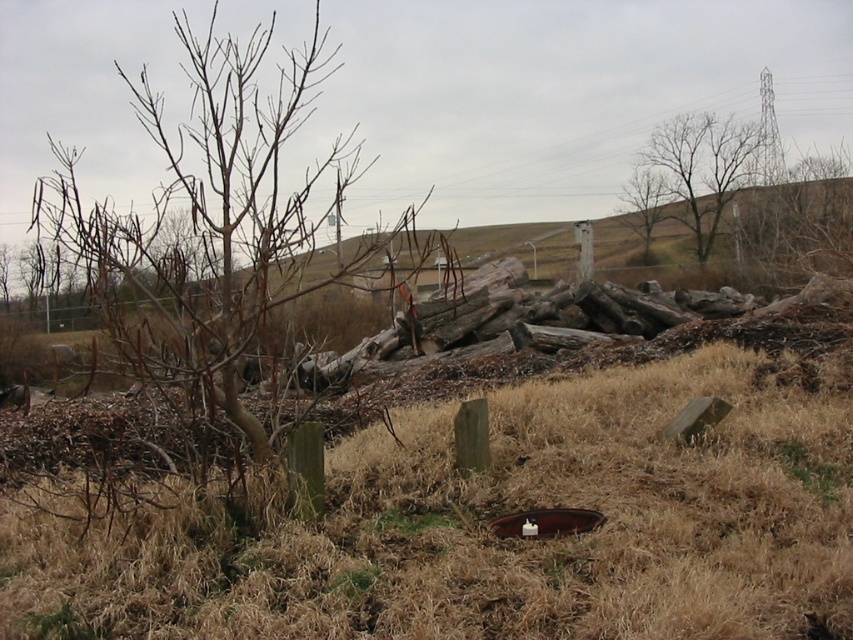
You are a photographer trying to capture a closeup of the brown dry grass at center while also including the bare wood tree at upper right in the background. Is this possible given their positions?

Yes, since the brown dry grass at center is closer to the viewer than the bare wood tree at upper right, you can focus on the brown dry grass at center and have the bare wood tree at upper right naturally appear in the background of the photo.

You are an architect designing a new garden layout. You need to place a small statue between the bare wood tree at upper right and the brown wood tree at upper center. Based on their heights, which tree should the statue be closer to for visual balance?

The statue should be closer to the brown wood tree at upper center because the bare wood tree at upper right is shorter, so positioning the statue near the taller tree balances the composition.